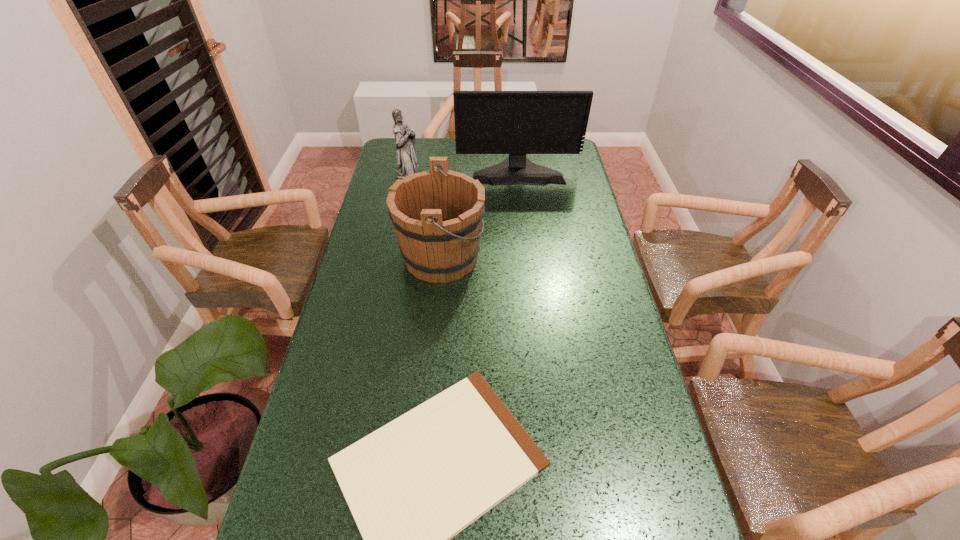
The image size is (960, 540). Find the location of `object located in the right edge section of the desktop`. object located in the right edge section of the desktop is located at coordinates (517, 123).

At what (x,y) coordinates should I click in order to perform the action: click on object that is at the far left corner. Please return your answer as a coordinate pair (x, y). This screenshot has height=540, width=960. Looking at the image, I should click on (407, 164).

Locate an element on the screen. The width and height of the screenshot is (960, 540). object located at the far right corner is located at coordinates (517, 123).

The width and height of the screenshot is (960, 540). I want to click on vacant space at the far edge, so click(503, 156).

Locate an element on the screen. The height and width of the screenshot is (540, 960). free space at the left edge is located at coordinates (365, 287).

Find the location of `vacant point at the right edge`. vacant point at the right edge is located at coordinates [x=654, y=451].

The width and height of the screenshot is (960, 540). I want to click on object that is the closest one to the second nearest object, so 517,123.

The image size is (960, 540). What are the coordinates of `object that is the nearest to the figurine` in the screenshot? It's located at (517, 123).